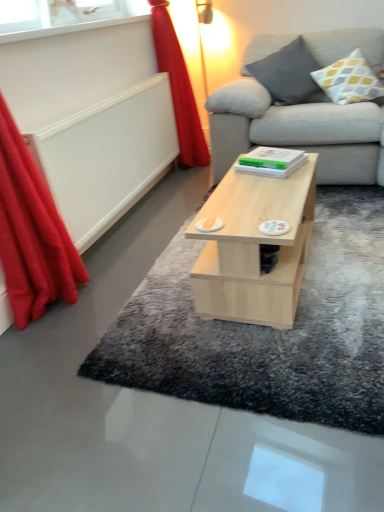
Find the location of a particular element. Image resolution: width=384 pixels, height=512 pixels. vacant area on top of light wood coffee table at center (from a real-world perspective) is located at coordinates (259, 197).